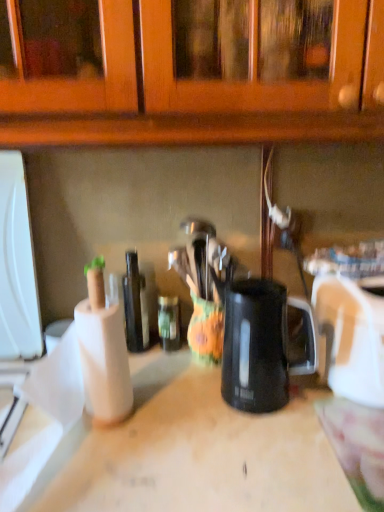
Locate an element on the screen. The width and height of the screenshot is (384, 512). vacant area that is in front of shiny dark glass bottle at center, which is the first bottle from left to right is located at coordinates (154, 385).